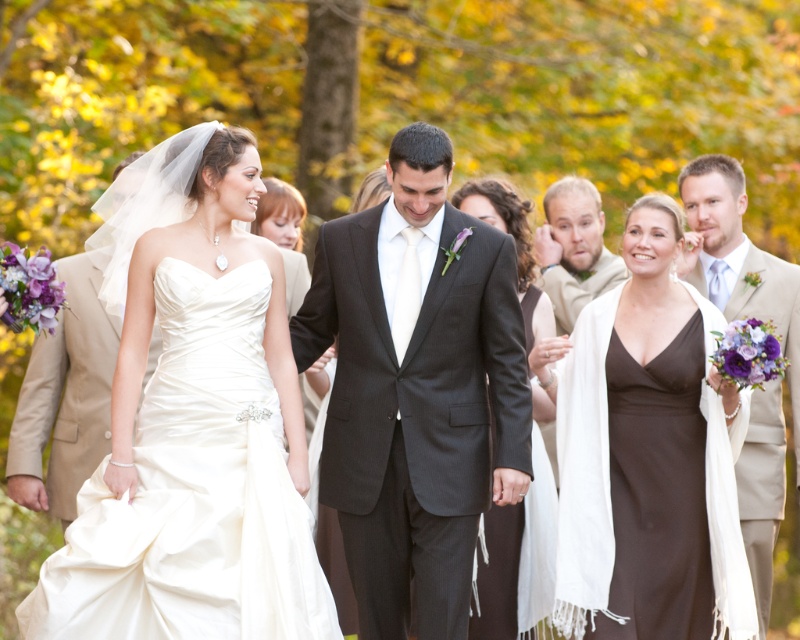
Question: Does matte black suit at center have a greater width compared to tan fabric suit at left?

Choices:
 (A) yes
 (B) no

Answer: (A)

Question: Is light beige suit at right positioned in front of light brown hair at upper center?

Choices:
 (A) yes
 (B) no

Answer: (A)

Question: Which point is closer to the camera?

Choices:
 (A) (204, 323)
 (B) (422, 621)
 (C) (92, 316)
 (D) (501, 604)

Answer: (A)

Question: Based on their relative distances, which object is nearer to the satin dress at center?

Choices:
 (A) matte black suit at center
 (B) light beige suit at right

Answer: (A)

Question: Considering the relative positions of matte black suit at center and brown satin dress at center in the image provided, where is matte black suit at center located with respect to brown satin dress at center?

Choices:
 (A) right
 (B) left

Answer: (B)

Question: Based on their relative distances, which object is farther from the matte black dress at center?

Choices:
 (A) tan fabric suit at left
 (B) light beige suit at right

Answer: (A)